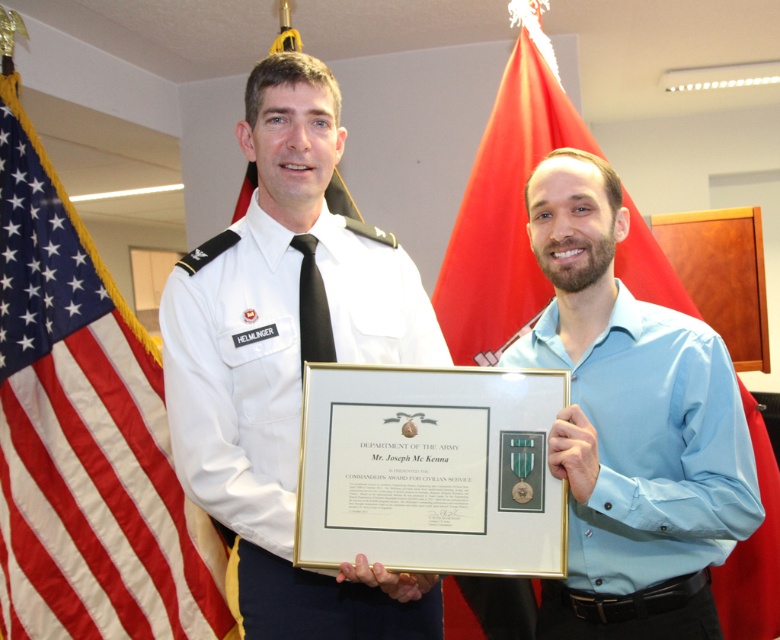
You are an event organizer arranging a photo shoot for a military award ceremony. You need to ensure that the light blue cotton shirt at center and the red fabric flag at upper center are both visible in the final photo. Based on their sizes, which object should you prioritize positioning closer to the camera to maintain clarity?

The light blue cotton shirt at center should be positioned closer to the camera because it occupies less space than the red fabric flag at upper center, making it smaller and potentially harder to see from a distance.

You are a photographer setting up for a formal event. You need to ensure that the white uniform at center and the red fabric flag at upper center are both visible in your photo. Based on their sizes, which object should you focus on first to ensure proper framing?

The white uniform at center is not as tall as the red fabric flag at upper center, so you should focus on the red fabric flag at upper center first to ensure it fits within the frame properly.

You are an assistant tasked with identifying the position of objects in the scene. Where is the white uniform at center located?

The white uniform at center is located at point (236, 376).